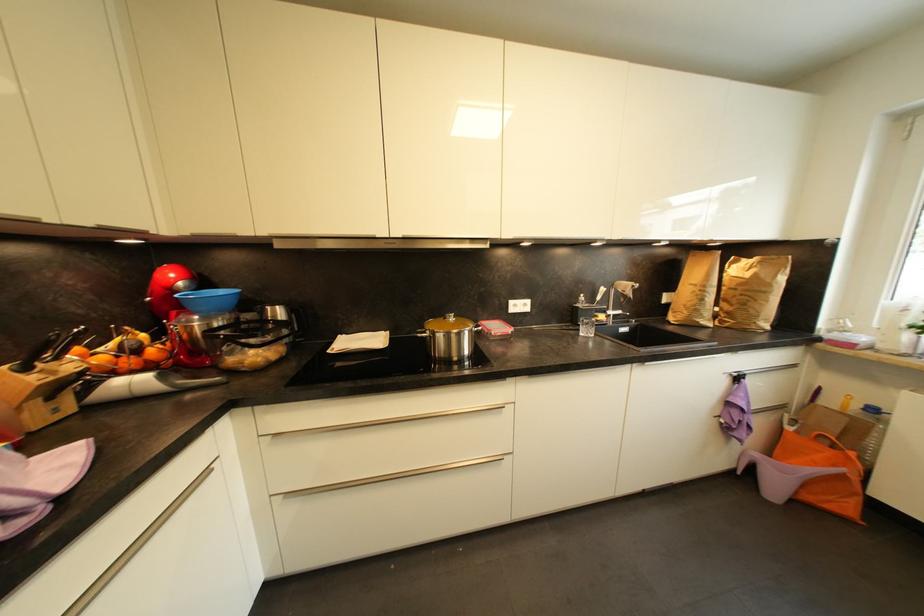
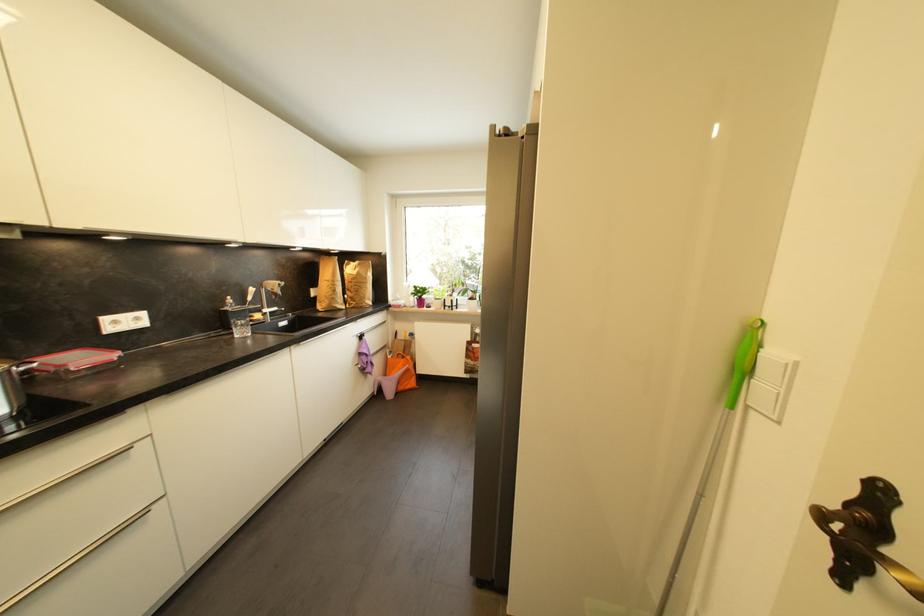
In the second image, find the point that corresponds to point 470,354 in the first image.

(8, 411)